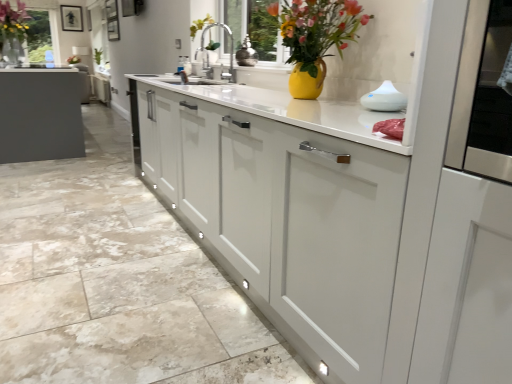
Question: In the image, is white matte cabinet at center, positioned as the second cabinetry in bottom-to-top order, on the left side or the right side of matte black picture frame at upper center?

Choices:
 (A) right
 (B) left

Answer: (A)

Question: In terms of width, does white matte cabinet at center, which appears as the first cabinetry when viewed from the back, look wider or thinner when compared to matte black picture frame at upper center?

Choices:
 (A) wide
 (B) thin

Answer: (A)

Question: Which of these objects is positioned closest to the matte black picture frame at upper center?

Choices:
 (A) matte yellow vase at upper center, arranged as the second floral arrangement when viewed from the top
 (B) white matte cabinet at center, which is the 1th cabinetry in top-to-bottom order
 (C) matte white cabinet at center, the 2th cabinetry when ordered from top to bottom
 (D) matte black vase at upper left, acting as the 1th floral arrangement starting from the back
 (E) white glossy diffuser at upper right, which is counted as the second appliance, starting from the left

Answer: (D)

Question: Which is nearer to the matte black vase at upper left, which appears as the second floral arrangement when ordered from the bottom?

Choices:
 (A) white glossy diffuser at upper right, arranged as the 1th appliance when viewed from the right
 (B) white matte cabinet at center, positioned as the second cabinetry in bottom-to-top order
 (C) shiny metallic vase at center, the second appliance viewed from the right
 (D) matte black picture frame at upper center
 (E) matte white cabinet at center, which is the first cabinetry in bottom-to-top order

Answer: (D)